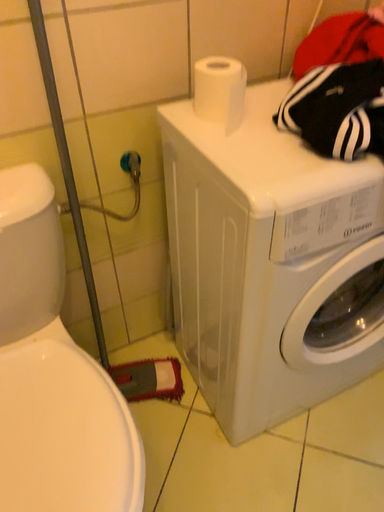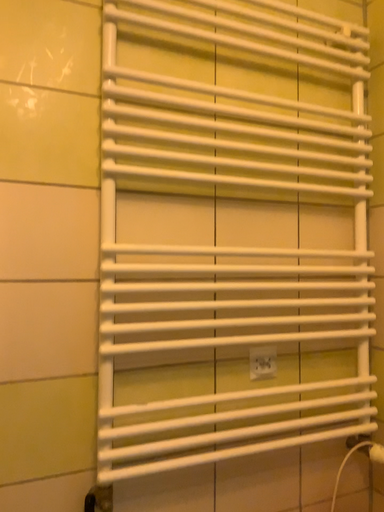
Question: How did the camera likely rotate when shooting the video?

Choices:
 (A) rotated downward
 (B) rotated upward

Answer: (B)